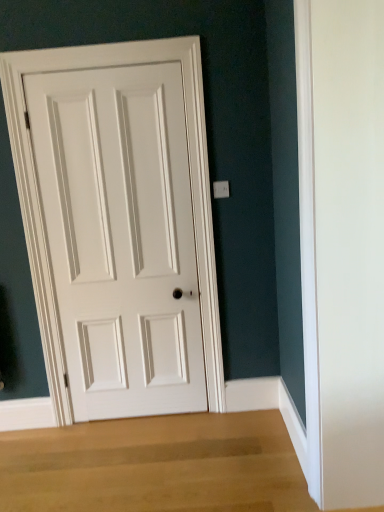
Locate an element on the screen. vacant area on top of white matte door at center (from a real-world perspective) is located at coordinates coord(99,67).